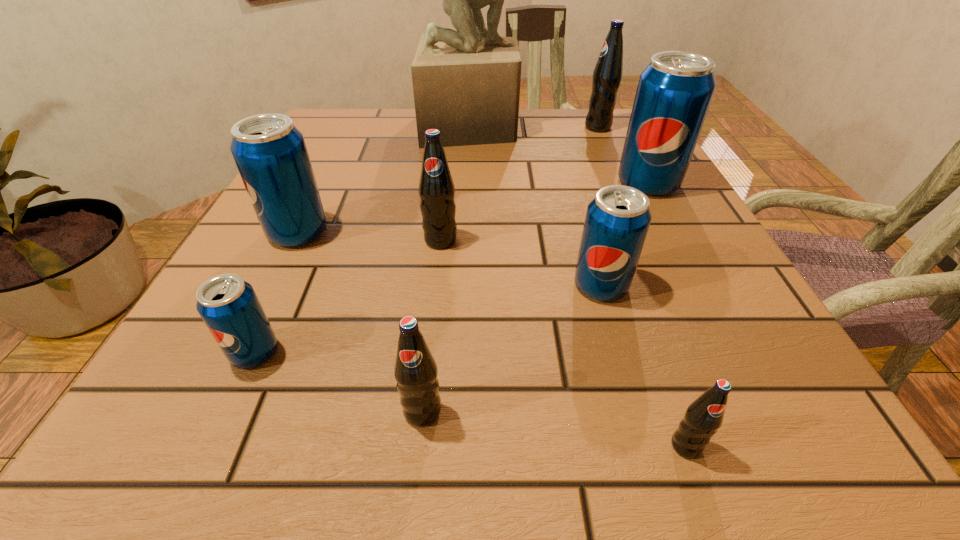
You are a GUI agent. You are given a task and a screenshot of the screen. Output one action in this format:
    pyautogui.click(x=<x>, y=<y>)
    Task: Click on the free spot between the farthest pop and the tallest object
    The width and height of the screenshot is (960, 540).
    Given the screenshot: What is the action you would take?
    pyautogui.click(x=535, y=127)

Identify the location of free space that is in between the third smallest black pop and the second biggest blue pop soda. The height and width of the screenshot is (540, 960). click(370, 237).

This screenshot has height=540, width=960. I want to click on free spot between the farthest blue pop soda and the second farthest black pop, so click(544, 212).

You are a GUI agent. You are given a task and a screenshot of the screen. Output one action in this format:
    pyautogui.click(x=<x>, y=<y>)
    Task: Click on the vacant area between the second biggest black pop and the farthest black pop
    The height and width of the screenshot is (540, 960).
    Given the screenshot: What is the action you would take?
    pyautogui.click(x=519, y=184)

At what (x,y) coordinates should I click in order to perform the action: click on blank region between the second nearest object and the third nearest black pop. Please return your answer as a coordinate pair (x, y). The width and height of the screenshot is (960, 540). Looking at the image, I should click on (431, 326).

Locate which object ranks fifth in proximity to the tallest object. Please provide its 2D coordinates. Your answer should be formatted as a tuple, i.e. [(x, y)], where the tuple contains the x and y coordinates of a point satisfying the conditions above.

[(617, 220)]

This screenshot has width=960, height=540. In order to click on object that ranks as the seventh closest to the second farthest black pop in this screenshot , I will do `click(704, 416)`.

Locate an element on the screen. the seventh closest pop relative to the second nearest pop is located at coordinates (607, 75).

Identify which pop is located as the nearest to the second black pop from right to left. Please provide its 2D coordinates. Your answer should be formatted as a tuple, i.e. [(x, y)], where the tuple contains the x and y coordinates of a point satisfying the conditions above.

[(617, 220)]

Where is `blue pop soda object that ranks as the closest to the third smallest black pop`? This screenshot has height=540, width=960. blue pop soda object that ranks as the closest to the third smallest black pop is located at coordinates (270, 153).